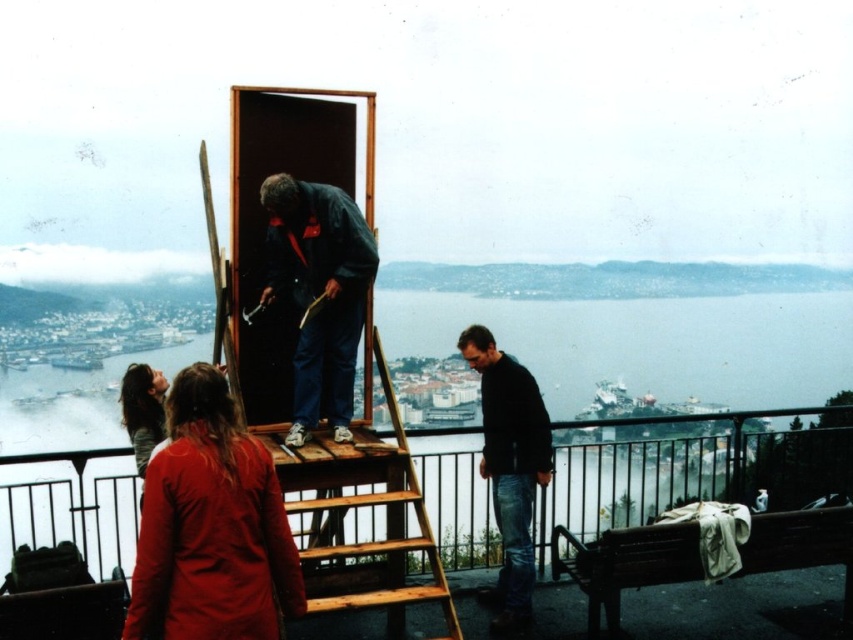
You are a photographer trying to capture a photo of both the red woolen sweater at lower left and the dark blue fabric jacket at center in the same frame. Given that your camera has a focal length of 50mm, which is suitable for capturing objects within a 10 meter distance, can you include both items in your shot?

The red woolen sweater at lower left and dark blue fabric jacket at center are 18.89 meters apart from each other. Since the camera can only capture objects within 10 meters, the distance between them exceeds the camera range, making it impossible to include both in the same frame.

You are a photographer trying to capture the man in the scene. You notice the red woolen sweater at lower left and the wooden at center. To ensure both objects are in the frame, should you adjust your camera to the left or right?

The red woolen sweater at lower left is to the left of wooden at center, so you should adjust your camera to the left to include both objects in the frame.

Based on the photo, you are standing on the wooden platform and want to walk towards the open doorway above you. There are two points marked on the platform at coordinates point (218, 422) and point (351, 480). Which point should you step on first to reach the doorway?

You should step on point (218, 422) first because it is in front of point (351, 480), meaning it is closer to the doorway.